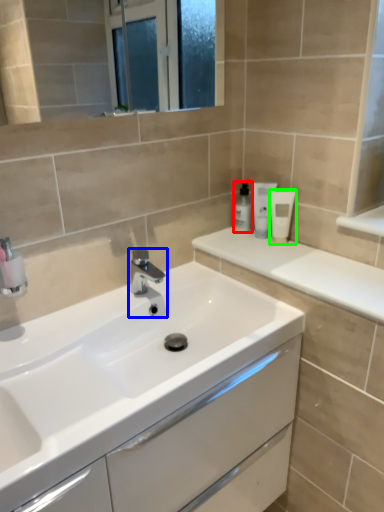
Question: Which object is positioned closest to toiletry (highlighted by a red box)? Select from tap (highlighted by a blue box) and toiletry (highlighted by a green box).

Choices:
 (A) tap
 (B) toiletry

Answer: (B)